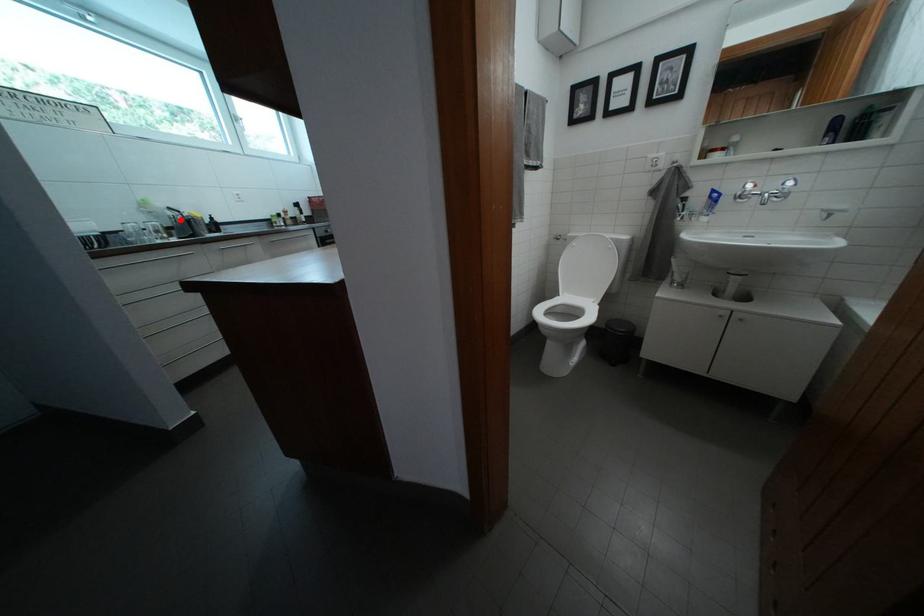
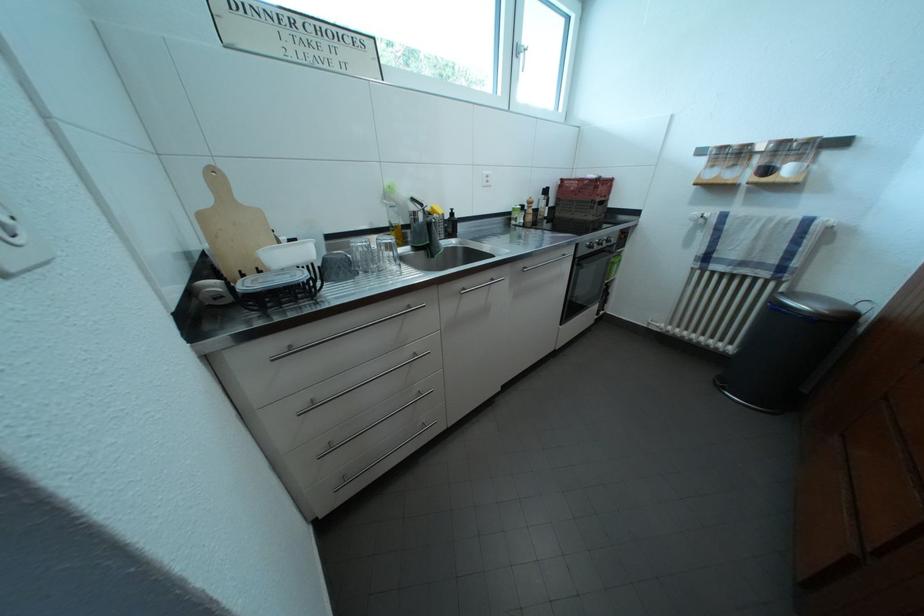
In the second image, find the point that corresponds to the highlighted location in the first image.

(421, 213)